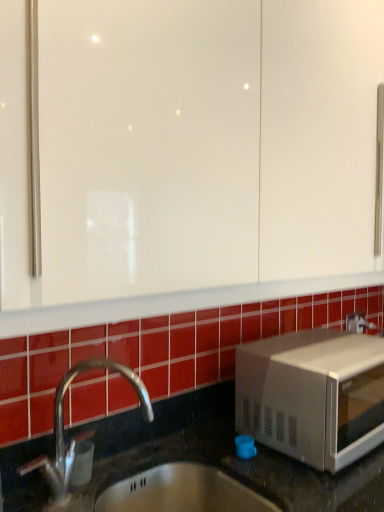
Question: Is point (369, 397) closer or farther from the camera than point (89, 473)?

Choices:
 (A) closer
 (B) farther

Answer: (B)

Question: Is white matte microwave at lower right bigger or smaller than clear plastic soap dispenser at lower left?

Choices:
 (A) small
 (B) big

Answer: (B)

Question: From a real-world perspective, relative to clear plastic soap dispenser at lower left, is white matte microwave at lower right vertically above or below?

Choices:
 (A) above
 (B) below

Answer: (A)

Question: Is point (92, 451) closer or farther from the camera than point (317, 353)?

Choices:
 (A) farther
 (B) closer

Answer: (B)

Question: Considering the positions of clear plastic soap dispenser at lower left and white matte microwave at lower right in the image, is clear plastic soap dispenser at lower left wider or thinner than white matte microwave at lower right?

Choices:
 (A) wide
 (B) thin

Answer: (B)

Question: From the image's perspective, is clear plastic soap dispenser at lower left located above or below white matte microwave at lower right?

Choices:
 (A) below
 (B) above

Answer: (A)

Question: Is clear plastic soap dispenser at lower left inside the boundaries of white matte microwave at lower right, or outside?

Choices:
 (A) outside
 (B) inside

Answer: (A)